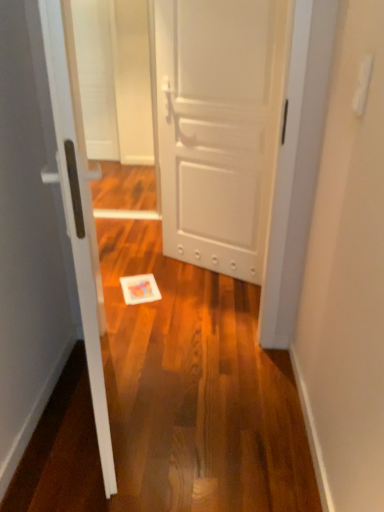
Find the location of a particular element. The image size is (384, 512). vacant space in front of white matte door at center, positioned as the 1th door in back-to-front order is located at coordinates (203, 297).